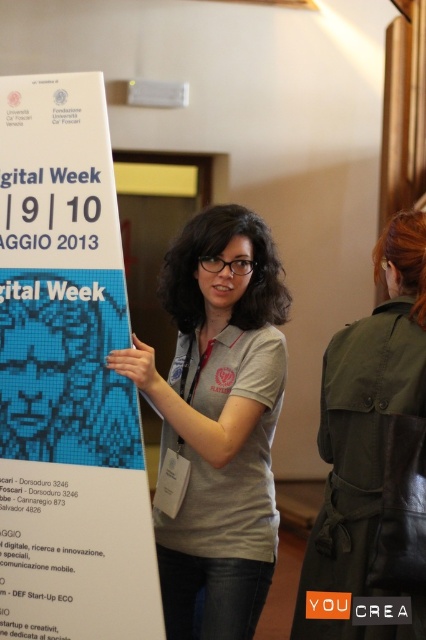
Question: Does white paper poster at upper left have a lesser width compared to gray fabric shirt at center?

Choices:
 (A) yes
 (B) no

Answer: (A)

Question: Which object is the farthest from the green leather jacket at upper right?

Choices:
 (A) white paper poster at upper left
 (B) gray fabric shirt at center

Answer: (A)

Question: Can you confirm if white paper poster at upper left is positioned to the left of gray fabric shirt at center?

Choices:
 (A) no
 (B) yes

Answer: (B)

Question: Is white paper poster at upper left above gray fabric shirt at center?

Choices:
 (A) no
 (B) yes

Answer: (B)

Question: Which of the following is the farthest from the observer?

Choices:
 (A) (213, 577)
 (B) (405, 611)
 (C) (68, 316)

Answer: (A)

Question: Among these objects, which one is nearest to the camera?

Choices:
 (A) green leather jacket at upper right
 (B) white paper poster at upper left
 (C) gray fabric shirt at center

Answer: (A)